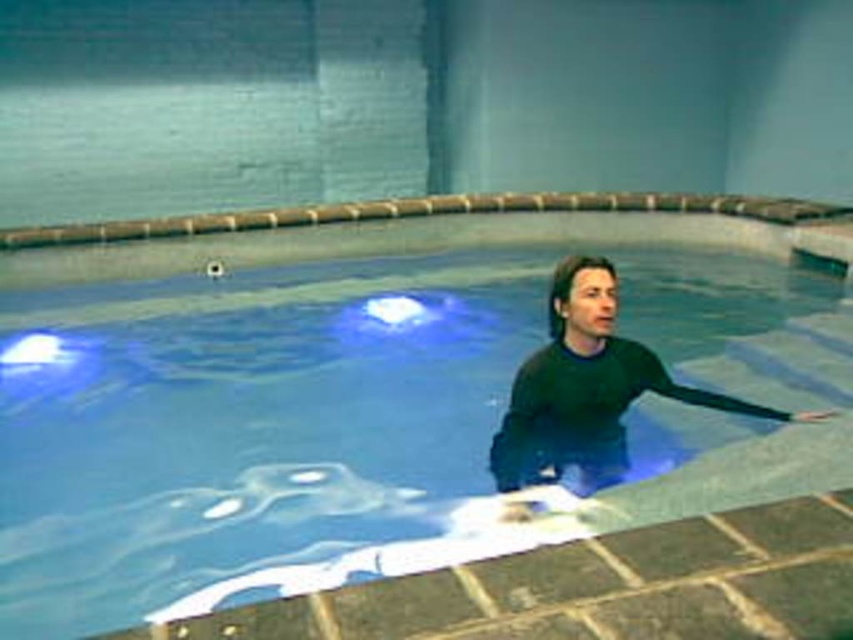
Question: Can you confirm if transparent glass swimming pool at center is smaller than black matte wetsuit at center?

Choices:
 (A) no
 (B) yes

Answer: (A)

Question: Among these objects, which one is nearest to the camera?

Choices:
 (A) transparent glass swimming pool at center
 (B) black matte wetsuit at center

Answer: (A)

Question: Does transparent glass swimming pool at center appear on the left side of black matte wetsuit at center?

Choices:
 (A) no
 (B) yes

Answer: (B)

Question: Does transparent glass swimming pool at center lie behind black matte wetsuit at center?

Choices:
 (A) yes
 (B) no

Answer: (B)

Question: Which point is closer to the camera taking this photo?

Choices:
 (A) (135, 316)
 (B) (564, 326)

Answer: (B)

Question: Which point is closer to the camera?

Choices:
 (A) (526, 472)
 (B) (664, 262)

Answer: (A)